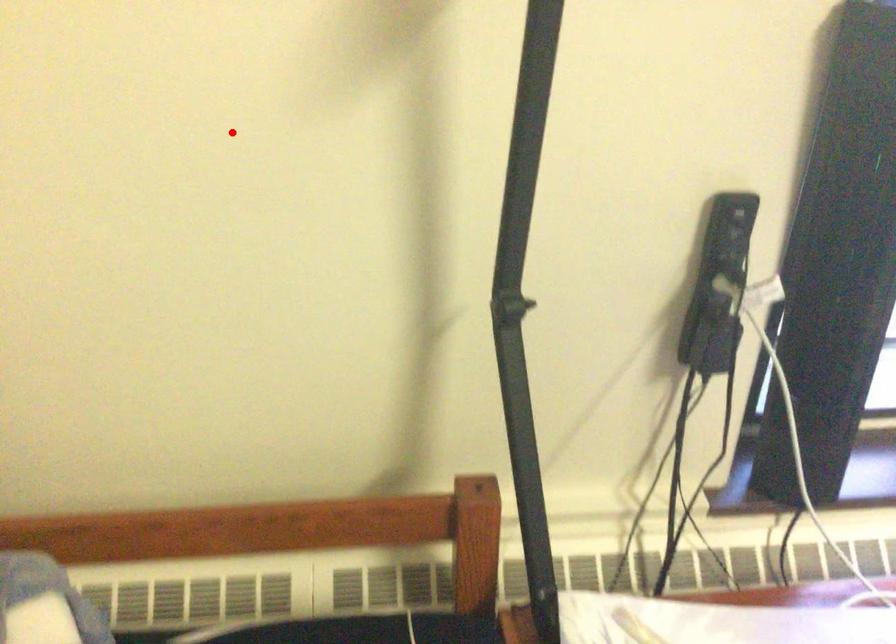
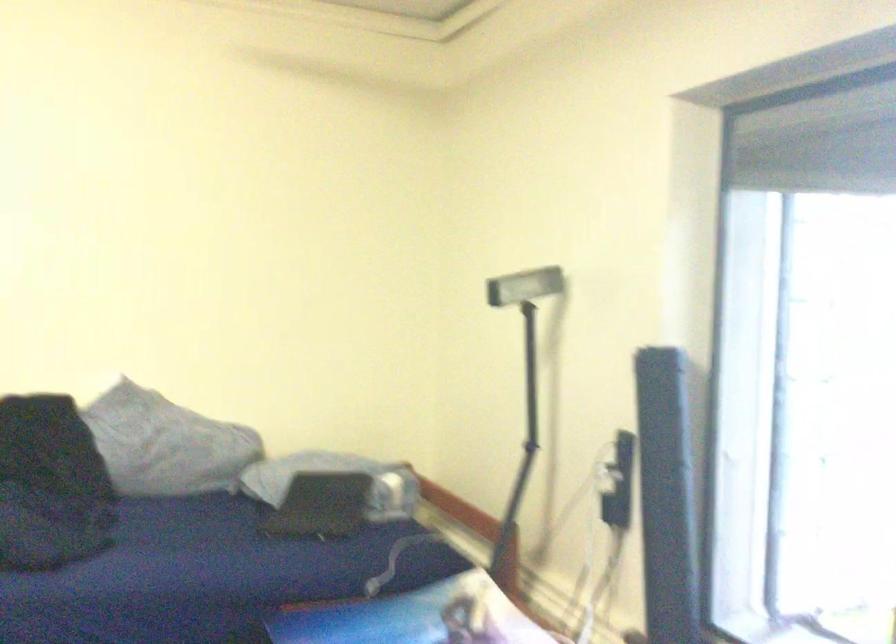
Question: I am providing you with two images of the same scene from different viewpoints. Given a red point in image1, look at the same physical point in image2. Is it:

Choices:
 (A) Closer to the viewpoint
 (B) Farther from the viewpoint

Answer: (B)